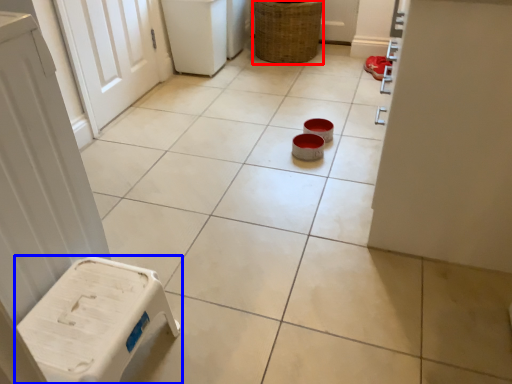
Question: Which point is further to the camera, basket (highlighted by a red box) or furniture (highlighted by a blue box)?

Choices:
 (A) basket
 (B) furniture

Answer: (A)